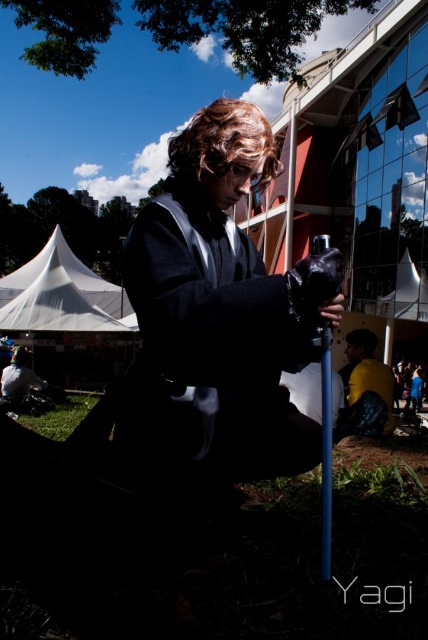
You are organizing a costume party and need to decide which outfit to display first. The matte black kimono at center and the yellow matte jacket at lower right are both candidates. Based on their sizes, which one should you choose to place on the larger display stand?

The matte black kimono at center might be wider than yellow matte jacket at lower right, so it should be placed on the larger display stand.

You are a photographer trying to capture the perfect shot of the person in the dark outfit. The person is standing at point (222, 300). You want to position your camera so that the matte black kimono at center is centered in the frame. Which direction should you move your camera to achieve this?

The matte black kimono at center is already located at point (222, 300), so the camera is already centered on it. No adjustment is needed.

You are an observer standing in the park scene. You notice the matte black kimono at center and the yellow matte jacket at lower right. Which object is positioned higher in the image?

The matte black kimono at center is located above the yellow matte jacket at lower right, so it is positioned higher in the image.